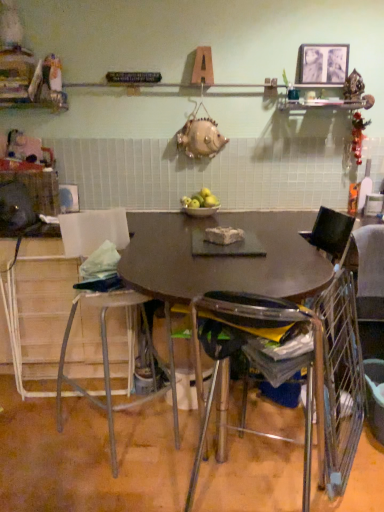
Identify the location of metallic wire chair at right, marked as the 3th chair in a left-to-right arrangement. (334, 228).

The width and height of the screenshot is (384, 512). In order to click on green matte apples at center in this screenshot , I will do `click(200, 200)`.

This screenshot has height=512, width=384. Describe the element at coordinates (222, 258) in the screenshot. I see `matte brown table at center` at that location.

Where is `metallic silver picture frame at upper right`? Image resolution: width=384 pixels, height=512 pixels. metallic silver picture frame at upper right is located at coordinates (322, 64).

What is the approximate width of metallic silver picture frame at upper right?

It is 4.23 centimeters.

This screenshot has height=512, width=384. In order to click on metallic stool at lower left, which is the 1th chair from left to right in this screenshot , I will do `click(108, 362)`.

The height and width of the screenshot is (512, 384). What do you see at coordinates (261, 359) in the screenshot?
I see `clear plastic chair at center, the second chair from the right` at bounding box center [261, 359].

Where is `metallic wire chair at right, marked as the 3th chair in a left-to-right arrangement`? Image resolution: width=384 pixels, height=512 pixels. metallic wire chair at right, marked as the 3th chair in a left-to-right arrangement is located at coordinates (334, 228).

From the image's perspective, is clear plastic chair at center, the second chair from the right, located above green matte apples at center?

No, from the image's perspective, clear plastic chair at center, the second chair from the right, is not on top of green matte apples at center.

From a real-world perspective, is clear plastic chair at center, the second chair from the right, physically located above or below green matte apples at center?

Clearly, from a real-world perspective, clear plastic chair at center, the second chair from the right, is below green matte apples at center.

Considering the sizes of objects clear plastic chair at center, the 2th chair in the left-to-right sequence, and green matte apples at center in the image provided, who is wider, clear plastic chair at center, the 2th chair in the left-to-right sequence, or green matte apples at center?

With larger width is clear plastic chair at center, the 2th chair in the left-to-right sequence.

The image size is (384, 512). Find the location of `chair below the metallic stool at lower left, the 3th chair from the right (from a real-world perspective)`. chair below the metallic stool at lower left, the 3th chair from the right (from a real-world perspective) is located at coordinates (261, 359).

Is metallic stool at lower left, which is the 1th chair from left to right, far from clear plastic chair at center, the 2th chair in the left-to-right sequence?

No.

Considering the relative positions of metallic stool at lower left, the 3th chair from the right, and clear plastic chair at center, the 2th chair in the left-to-right sequence, in the image provided, is metallic stool at lower left, the 3th chair from the right, behind clear plastic chair at center, the 2th chair in the left-to-right sequence,?

Yes, it is.

Is metallic stool at lower left, which is the 1th chair from left to right, smaller than clear plastic chair at center, the second chair from the right?

Incorrect, metallic stool at lower left, which is the 1th chair from left to right, is not smaller in size than clear plastic chair at center, the second chair from the right.

Considering the relative sizes of clear plastic chair at center, the second chair from the right, and metallic stool at lower left, the 3th chair from the right, in the image provided, is clear plastic chair at center, the second chair from the right, smaller than metallic stool at lower left, the 3th chair from the right,?

Yes, clear plastic chair at center, the second chair from the right, is smaller than metallic stool at lower left, the 3th chair from the right.

From the image's perspective, which one is positioned lower, clear plastic chair at center, the 2th chair in the left-to-right sequence, or metallic stool at lower left, the 3th chair from the right?

clear plastic chair at center, the 2th chair in the left-to-right sequence.

How many degrees apart are the facing directions of clear plastic chair at center, the second chair from the right, and metallic stool at lower left, the 3th chair from the right?

There is a 116-degree angle between the facing directions of clear plastic chair at center, the second chair from the right, and metallic stool at lower left, the 3th chair from the right.

Are metallic silver picture frame at upper right and clear plastic chair at center, the second chair from the right, beside each other?

metallic silver picture frame at upper right and clear plastic chair at center, the second chair from the right, are clearly separated.

Is point (334, 67) positioned after point (313, 365)?

Yes, it is behind point (313, 365).

Find the location of a particular element. This screenshot has width=384, height=512. the 3rd chair located beneath the metallic silver picture frame at upper right (from a real-world perspective) is located at coordinates (261, 359).

From the picture: Who is shorter, metallic silver picture frame at upper right or clear plastic chair at center, the second chair from the right?

With less height is metallic silver picture frame at upper right.

Who is more distant, metallic wire chair at right, marked as the 3th chair in a left-to-right arrangement, or clear plastic chair at center, the 2th chair in the left-to-right sequence?

metallic wire chair at right, marked as the 3th chair in a left-to-right arrangement, is more distant.

From the picture: Is metallic wire chair at right, arranged as the first chair when viewed from the right, not near clear plastic chair at center, the 2th chair in the left-to-right sequence?

Actually, metallic wire chair at right, arranged as the first chair when viewed from the right, and clear plastic chair at center, the 2th chair in the left-to-right sequence, are a little close together.

Does metallic wire chair at right, arranged as the first chair when viewed from the right, have a smaller size compared to clear plastic chair at center, the second chair from the right?

Yes, metallic wire chair at right, arranged as the first chair when viewed from the right, is smaller than clear plastic chair at center, the second chair from the right.

Identify the location of apple located above the matte brown table at center (from the image's perspective). This screenshot has height=512, width=384. (200, 200).

From the image's perspective, is matte brown table at center above or below green matte apples at center?

Based on their image positions, matte brown table at center is located beneath green matte apples at center.

In the image, is matte brown table at center on the left side or the right side of green matte apples at center?

From the image, it's evident that matte brown table at center is to the right of green matte apples at center.

From the picture: From a real-world perspective, is matte brown table at center on green matte apples at center?

Incorrect, from a real-world perspective, matte brown table at center is lower than green matte apples at center.

Which is correct: green matte apples at center is inside clear plastic chair at center, the 2th chair in the left-to-right sequence, or outside of it?

green matte apples at center lies outside clear plastic chair at center, the 2th chair in the left-to-right sequence.

Which object is wider, green matte apples at center or clear plastic chair at center, the 2th chair in the left-to-right sequence?

With larger width is clear plastic chair at center, the 2th chair in the left-to-right sequence.

Based on the photo, who is shorter, green matte apples at center or clear plastic chair at center, the second chair from the right?

green matte apples at center.

Locate an element on the screen. apple behind the clear plastic chair at center, the second chair from the right is located at coordinates (200, 200).

You are a GUI agent. You are given a task and a screenshot of the screen. Output one action in this format:
    pyautogui.click(x=<x>, y=<y>)
    Task: Click on the chair below the metallic stool at lower left, the 3th chair from the right (from the image's perspective)
    The image size is (384, 512).
    Given the screenshot: What is the action you would take?
    pyautogui.click(x=261, y=359)

Considering their positions, is green matte apples at center positioned further to metallic stool at lower left, which is the 1th chair from left to right, than metallic silver picture frame at upper right?

metallic silver picture frame at upper right is positioned further to the anchor metallic stool at lower left, which is the 1th chair from left to right.

From the picture: From the image, which object appears to be nearer to metallic silver picture frame at upper right, matte brown table at center or clear plastic chair at center, the 2th chair in the left-to-right sequence?

Among the two, matte brown table at center is located nearer to metallic silver picture frame at upper right.

From the image, which object appears to be farther from metallic wire chair at right, marked as the 3th chair in a left-to-right arrangement, clear plastic chair at center, the second chair from the right, or matte brown table at center?

The object further to metallic wire chair at right, marked as the 3th chair in a left-to-right arrangement, is clear plastic chair at center, the second chair from the right.

Estimate the real-world distances between objects in this image. Which object is further from matte brown table at center, metallic silver picture frame at upper right or clear plastic chair at center, the second chair from the right?

Based on the image, metallic silver picture frame at upper right appears to be further to matte brown table at center.

Estimate the real-world distances between objects in this image. Which object is closer to green matte apples at center, metallic wire chair at right, arranged as the first chair when viewed from the right, or clear plastic chair at center, the 2th chair in the left-to-right sequence?

metallic wire chair at right, arranged as the first chair when viewed from the right, is closer to green matte apples at center.

Which object lies further to the anchor point metallic stool at lower left, which is the 1th chair from left to right, metallic wire chair at right, arranged as the first chair when viewed from the right, or matte brown table at center?

metallic wire chair at right, arranged as the first chair when viewed from the right, lies further to metallic stool at lower left, which is the 1th chair from left to right, than the other object.

Estimate the real-world distances between objects in this image. Which object is closer to clear plastic chair at center, the 2th chair in the left-to-right sequence, metallic stool at lower left, the 3th chair from the right, or metallic silver picture frame at upper right?

Based on the image, metallic stool at lower left, the 3th chair from the right, appears to be nearer to clear plastic chair at center, the 2th chair in the left-to-right sequence.

When comparing their distances from metallic wire chair at right, marked as the 3th chair in a left-to-right arrangement, does green matte apples at center or metallic stool at lower left, which is the 1th chair from left to right, seem further?

metallic stool at lower left, which is the 1th chair from left to right, is further to metallic wire chair at right, marked as the 3th chair in a left-to-right arrangement.

You are a GUI agent. You are given a task and a screenshot of the screen. Output one action in this format:
    pyautogui.click(x=<x>, y=<y>)
    Task: Click on the apple between metallic silver picture frame at upper right and metallic wire chair at right, marked as the 3th chair in a left-to-right arrangement, vertically
    The width and height of the screenshot is (384, 512).
    Given the screenshot: What is the action you would take?
    pyautogui.click(x=200, y=200)

Find the location of `picture frame positioned between clear plastic chair at center, the 2th chair in the left-to-right sequence, and green matte apples at center from near to far`. picture frame positioned between clear plastic chair at center, the 2th chair in the left-to-right sequence, and green matte apples at center from near to far is located at coordinates point(322,64).

Identify the location of chair situated between metallic stool at lower left, the 3th chair from the right, and metallic wire chair at right, arranged as the first chair when viewed from the right, from left to right. (261, 359).

At what (x,y) coordinates should I click in order to perform the action: click on apple between metallic silver picture frame at upper right and matte brown table at center in the vertical direction. Please return your answer as a coordinate pair (x, y). Image resolution: width=384 pixels, height=512 pixels. Looking at the image, I should click on (200, 200).